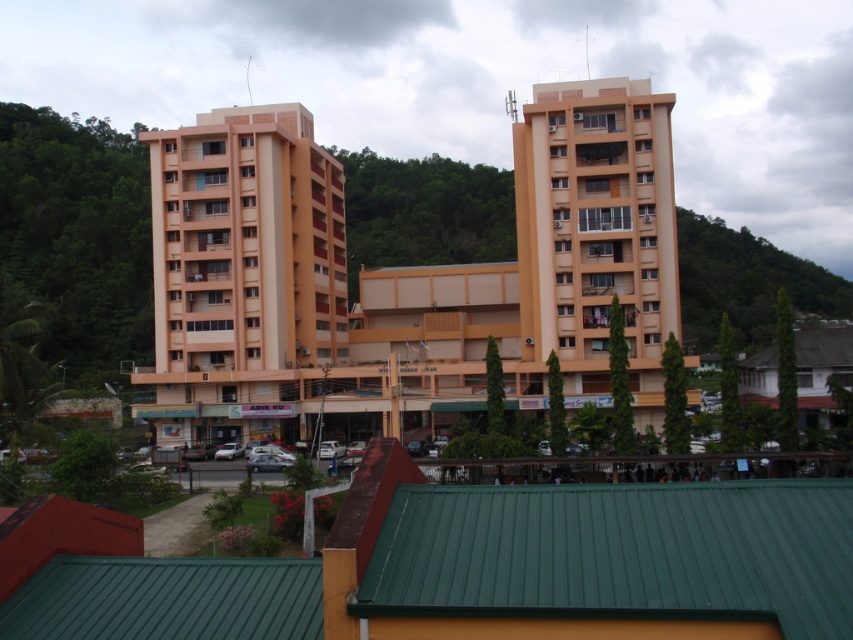
Question: Which point is farther to the camera?

Choices:
 (A) matte orange building at center
 (B) green leafy hillside at upper right

Answer: (B)

Question: Which point appears farthest from the camera in this image?

Choices:
 (A) (750, 314)
 (B) (247, 400)

Answer: (A)

Question: Considering the relative positions of matte orange building at center and green leafy hillside at upper right in the image provided, where is matte orange building at center located with respect to green leafy hillside at upper right?

Choices:
 (A) left
 (B) right

Answer: (A)

Question: Observing the image, what is the correct spatial positioning of matte orange building at center in reference to green leafy hillside at upper right?

Choices:
 (A) left
 (B) right

Answer: (A)

Question: Is matte orange building at center to the left of green leafy hillside at upper right from the viewer's perspective?

Choices:
 (A) yes
 (B) no

Answer: (A)